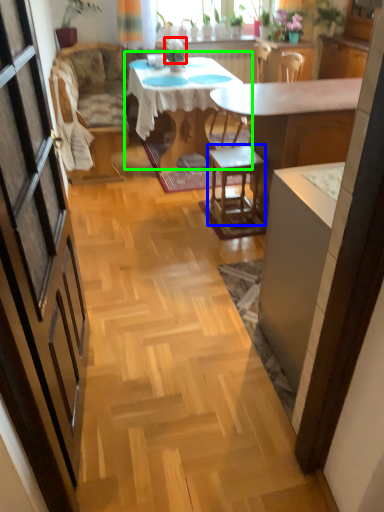
Question: Considering the real-world distances, which object is closest to plant (highlighted by a red box)? stool (highlighted by a blue box) or kitchen & dining room table (highlighted by a green box).

Choices:
 (A) stool
 (B) kitchen & dining room table

Answer: (B)